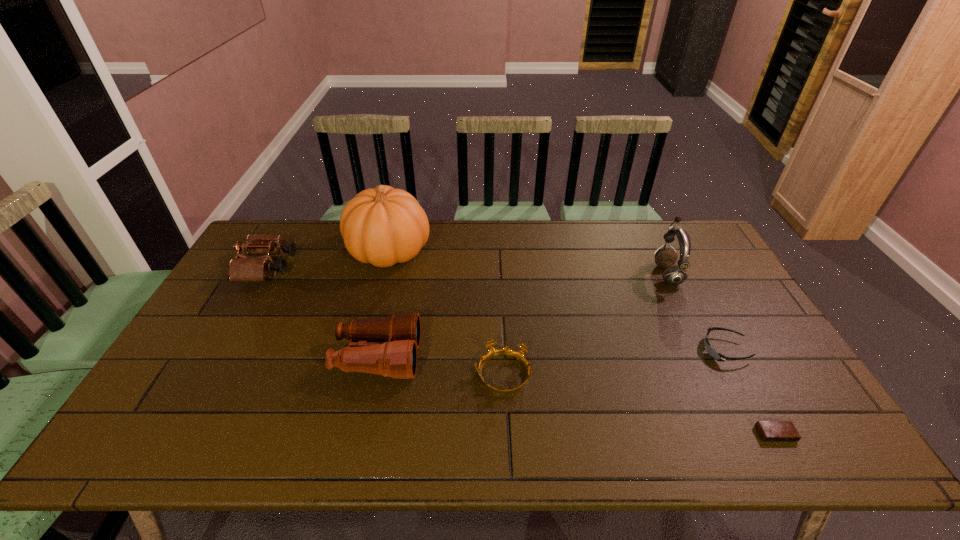
The width and height of the screenshot is (960, 540). I want to click on object present at the near right corner, so [770, 431].

The height and width of the screenshot is (540, 960). I want to click on free region at the far edge of the desktop, so pyautogui.click(x=423, y=255).

What are the coordinates of `free location at the near edge of the desktop` in the screenshot? It's located at (469, 428).

Image resolution: width=960 pixels, height=540 pixels. I want to click on free region at the left edge of the desktop, so click(158, 407).

Locate an element on the screen. This screenshot has height=540, width=960. vacant region at the right edge is located at coordinates (745, 323).

Identify the location of vacant space at the far left corner. The width and height of the screenshot is (960, 540). (296, 239).

At what (x,y) coordinates should I click in order to perform the action: click on blank space at the near left corner of the desktop. Please return your answer as a coordinate pair (x, y). Image resolution: width=960 pixels, height=540 pixels. Looking at the image, I should click on (197, 427).

Identify the location of free space between the sunglasses and the crown. pos(613,362).

Locate an element on the screen. free space between the earphone and the crown is located at coordinates tap(585, 325).

Identify the location of unoccupied position between the pumpkin and the right binoculars. (384, 305).